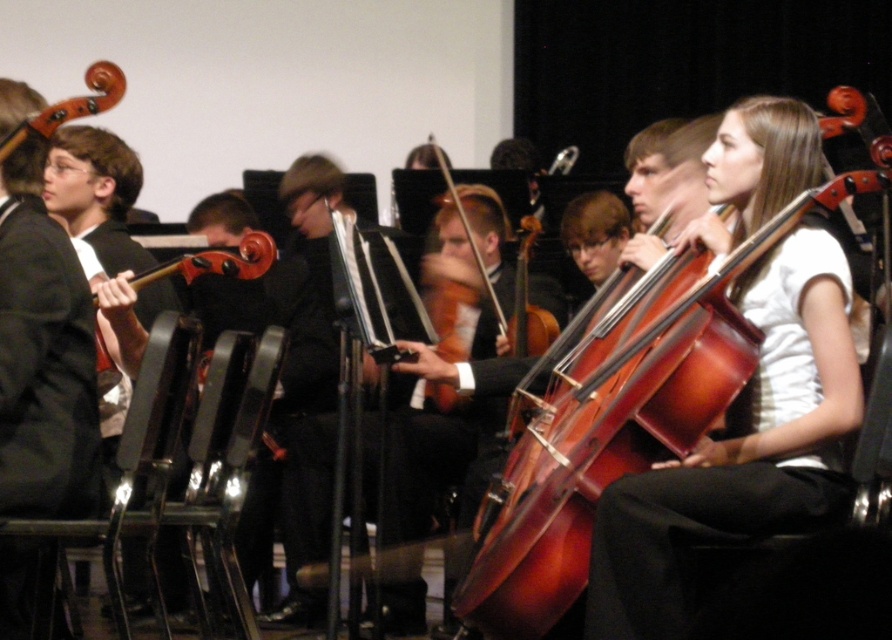
Does shiny red violin at center come in front of wooden violin at upper left?

No, shiny red violin at center is further to the viewer.

Based on the photo, is shiny red violin at center thinner than wooden violin at upper left?

No, shiny red violin at center is not thinner than wooden violin at upper left.

The height and width of the screenshot is (640, 892). What do you see at coordinates (186, 282) in the screenshot? I see `shiny red violin at center` at bounding box center [186, 282].

Where is `shiny red violin at center`? Image resolution: width=892 pixels, height=640 pixels. shiny red violin at center is located at coordinates (186, 282).

Is shiny brown cello at center below shiny black hat at center?

No.

Does shiny brown cello at center have a smaller size compared to shiny black hat at center?

No.

This screenshot has height=640, width=892. I want to click on shiny brown cello at center, so click(x=739, y=448).

What are the coordinates of `shiny brown cello at center` in the screenshot? It's located at (739, 448).

How far apart are shiny black hat at center and wooden violin at upper left?

1.93 meters

Locate an element on the screen. shiny black hat at center is located at coordinates (306, 513).

Where is `shiny black hat at center`? shiny black hat at center is located at coordinates (306, 513).

Locate an element on the screen. Image resolution: width=892 pixels, height=640 pixels. shiny black hat at center is located at coordinates (306, 513).